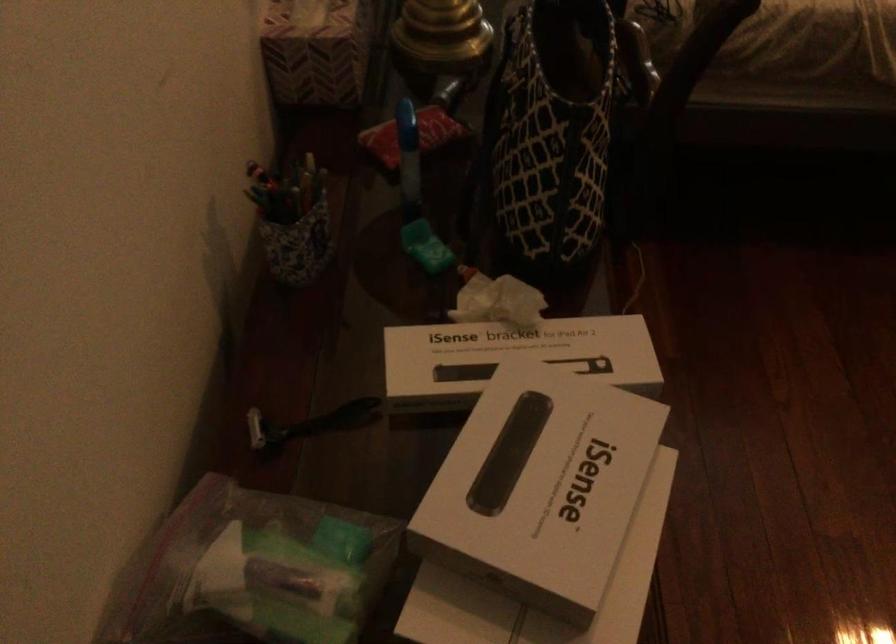
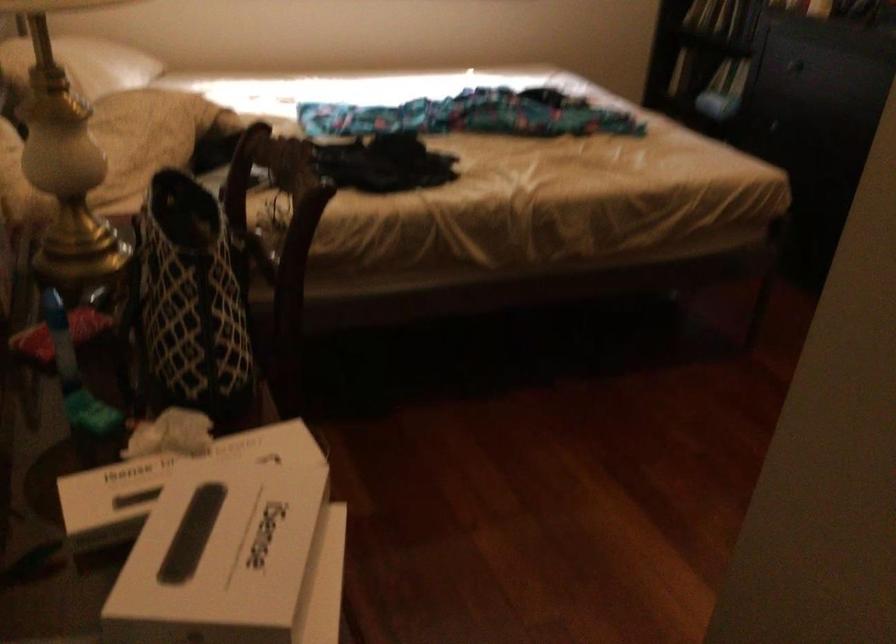
First-person continuous shooting, in which direction is the camera rotating?

The rotation direction of the camera is right-up.